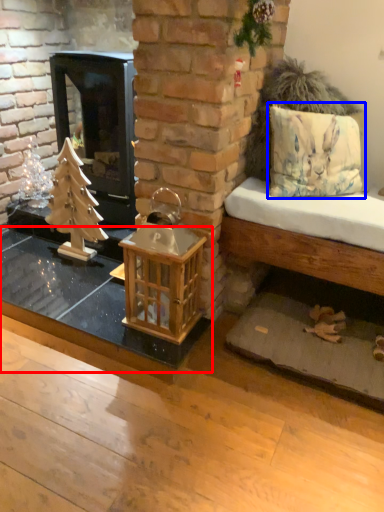
Question: Which object is closer to the camera taking this photo, table (highlighted by a red box) or pillow (highlighted by a blue box)?

Choices:
 (A) table
 (B) pillow

Answer: (B)